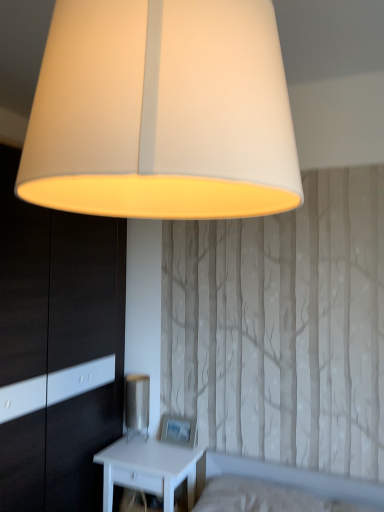
Question: Is metallic silver table lamp at lower center smaller than white glossy dresser at left?

Choices:
 (A) yes
 (B) no

Answer: (A)

Question: Is metallic silver table lamp at lower center facing away from white glossy dresser at left?

Choices:
 (A) no
 (B) yes

Answer: (A)

Question: From a real-world perspective, does metallic silver table lamp at lower center stand above white glossy dresser at left?

Choices:
 (A) no
 (B) yes

Answer: (A)

Question: Considering the relative sizes of metallic silver table lamp at lower center and white glossy dresser at left in the image provided, is metallic silver table lamp at lower center shorter than white glossy dresser at left?

Choices:
 (A) no
 (B) yes

Answer: (B)

Question: Could you tell me if metallic silver table lamp at lower center is facing white glossy dresser at left?

Choices:
 (A) yes
 (B) no

Answer: (B)

Question: Is the position of metallic silver table lamp at lower center less distant than that of white glossy dresser at left?

Choices:
 (A) yes
 (B) no

Answer: (B)

Question: Does matte white lampshade at upper center touch white matte nightstand at lower left?

Choices:
 (A) no
 (B) yes

Answer: (A)

Question: Can you confirm if matte white lampshade at upper center is bigger than white matte nightstand at lower left?

Choices:
 (A) no
 (B) yes

Answer: (B)

Question: Is matte white lampshade at upper center further to camera compared to white matte nightstand at lower left?

Choices:
 (A) yes
 (B) no

Answer: (B)

Question: Considering the relative sizes of matte white lampshade at upper center and white matte nightstand at lower left in the image provided, is matte white lampshade at upper center shorter than white matte nightstand at lower left?

Choices:
 (A) yes
 (B) no

Answer: (B)

Question: Can we say matte white lampshade at upper center lies outside white matte nightstand at lower left?

Choices:
 (A) yes
 (B) no

Answer: (A)

Question: Does matte white lampshade at upper center lie in front of white matte nightstand at lower left?

Choices:
 (A) no
 (B) yes

Answer: (B)

Question: Is metallic silver table lamp at lower center taller than white matte nightstand at lower left?

Choices:
 (A) yes
 (B) no

Answer: (B)